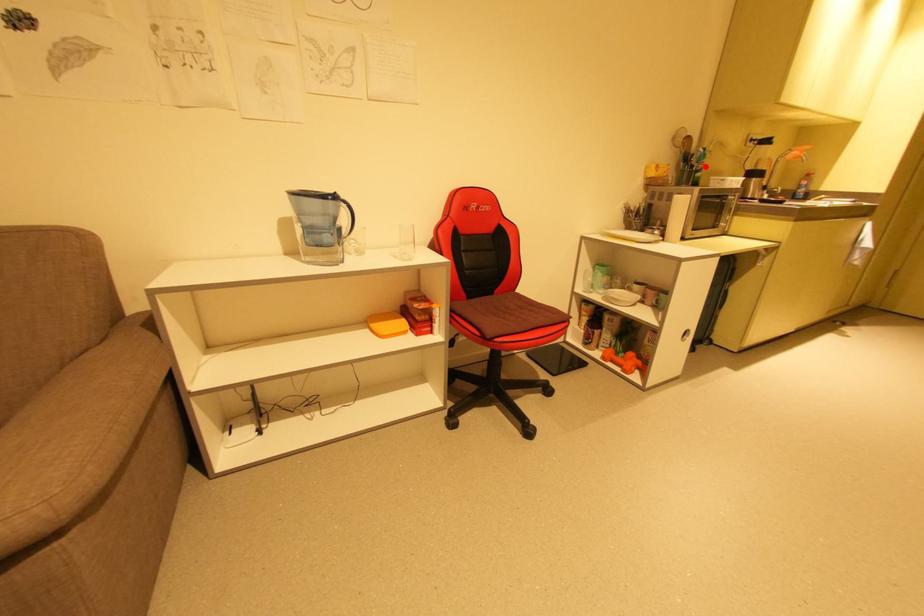
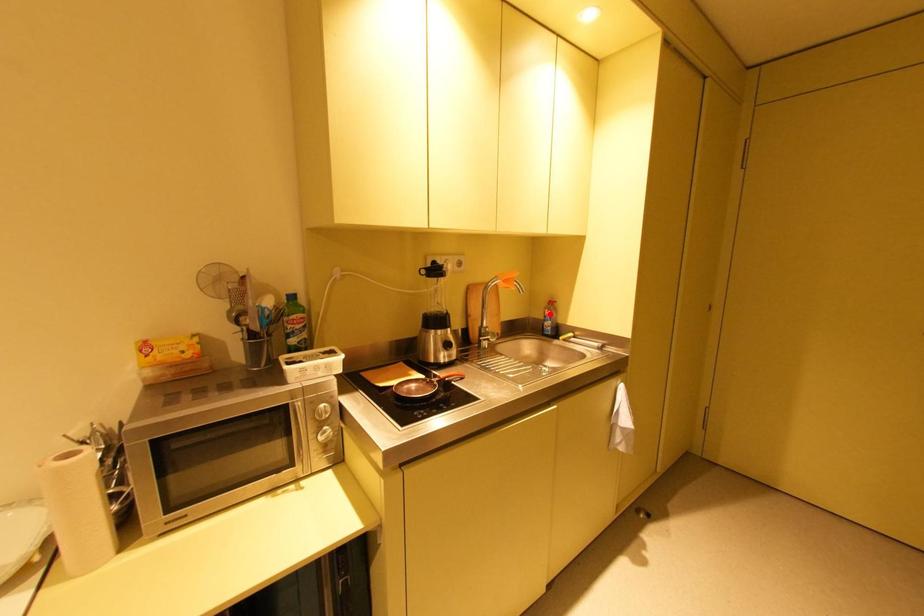
I am providing you with two images of the same scene from different viewpoints. A red point is marked on the first image and another point is marked on the second image. Do the highlighted points in image1 and image2 indicate the same real-world spot?

No